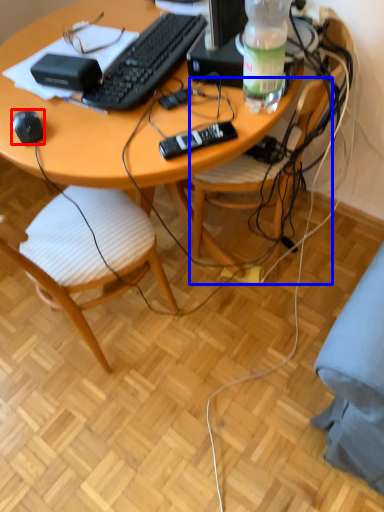
Question: Which object appears farthest to the camera in this image, computer mouse (highlighted by a red box) or chair (highlighted by a blue box)?

Choices:
 (A) computer mouse
 (B) chair

Answer: (A)